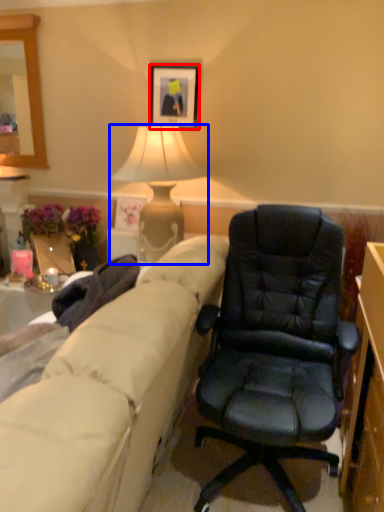
Question: Which object appears closest to the camera in this image, picture frame (highlighted by a red box) or lamp (highlighted by a blue box)?

Choices:
 (A) picture frame
 (B) lamp

Answer: (B)